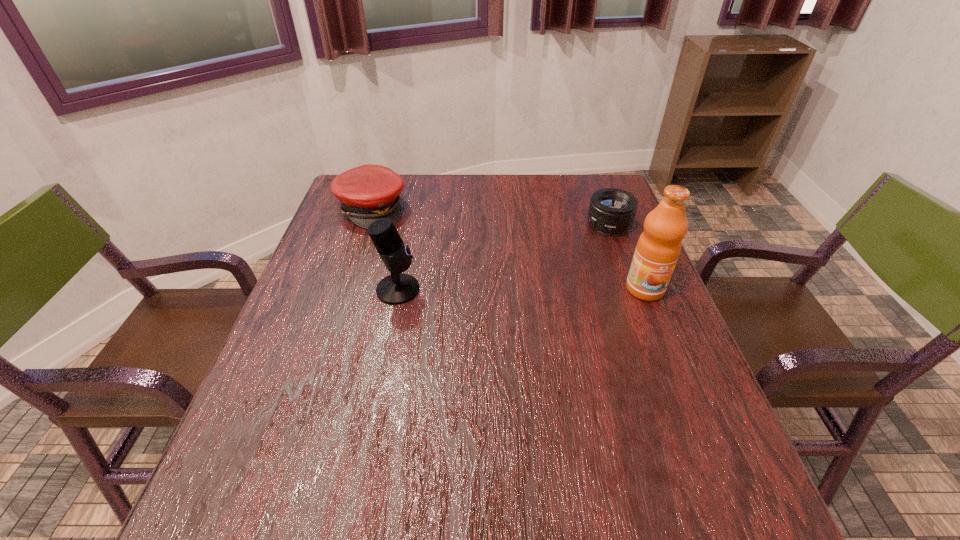
This screenshot has height=540, width=960. What are the coordinates of `free location at the near edge` in the screenshot? It's located at (615, 438).

Locate an element on the screen. free location at the left edge is located at coordinates (365, 281).

Identify the location of free space at the right edge. (668, 303).

I want to click on free space at the near left corner of the desktop, so click(x=304, y=462).

Where is `vacant region at the near right corner of the desktop`? vacant region at the near right corner of the desktop is located at coordinates (699, 458).

Where is `free area in between the telephoto lens and the microphone`? The width and height of the screenshot is (960, 540). free area in between the telephoto lens and the microphone is located at coordinates tap(503, 257).

This screenshot has height=540, width=960. I want to click on unoccupied position between the microphone and the shortest object, so click(x=503, y=257).

You are a GUI agent. You are given a task and a screenshot of the screen. Output one action in this format:
    pyautogui.click(x=<x>, y=<y>)
    Task: Click on the vacant space that's between the telephoto lens and the second shortest object
    
    Given the screenshot: What is the action you would take?
    pyautogui.click(x=491, y=217)

The height and width of the screenshot is (540, 960). Identify the location of empty location between the shortest object and the second shortest object. (491, 217).

What are the coordinates of `unoccupied area between the second tallest object and the telephoto lens` in the screenshot? It's located at (503, 257).